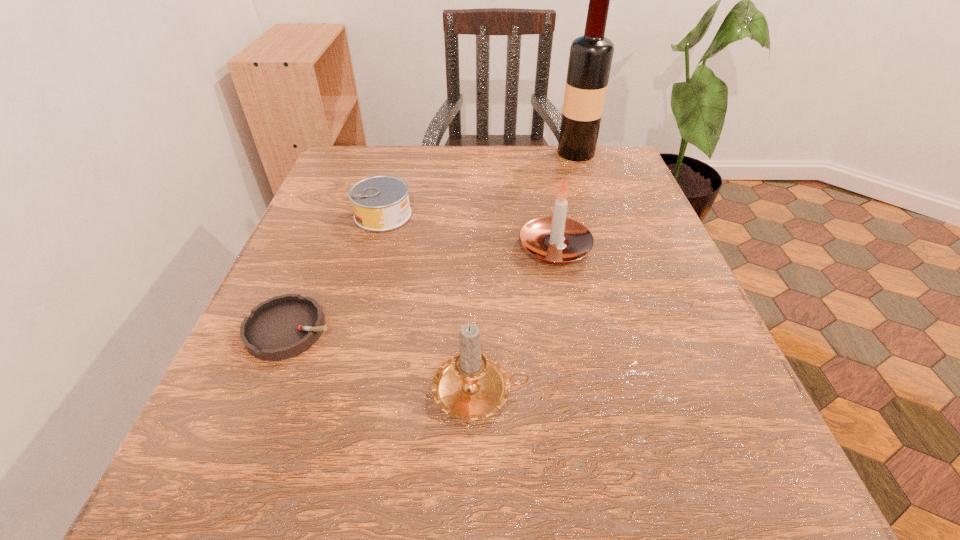
You are a GUI agent. You are given a task and a screenshot of the screen. Output one action in this format:
    pyautogui.click(x=<x>, y=<y>)
    Task: Click on the blank space at the left edge of the desktop
    This screenshot has width=960, height=540.
    Given the screenshot: What is the action you would take?
    pyautogui.click(x=335, y=254)

Where is `free space at the right edge of the desktop`? The width and height of the screenshot is (960, 540). free space at the right edge of the desktop is located at coordinates (644, 206).

Locate an element on the screen. vacant space at the far left corner of the desktop is located at coordinates (386, 174).

This screenshot has width=960, height=540. I want to click on blank space at the far right corner of the desktop, so click(x=576, y=162).

Image resolution: width=960 pixels, height=540 pixels. Identify the location of vacant area that lies between the fourth tallest object and the farthest object. (480, 184).

Locate an element on the screen. The height and width of the screenshot is (540, 960). unoccupied position between the fourth tallest object and the right candle is located at coordinates (468, 232).

Locate an element on the screen. The height and width of the screenshot is (540, 960). free space between the farther candle and the nearer candle is located at coordinates (517, 320).

Where is `free spot between the third object from right to left and the shortest object`? The image size is (960, 540). free spot between the third object from right to left and the shortest object is located at coordinates (385, 361).

Find the location of a particular element. unoccupied area between the left candle and the fourth tallest object is located at coordinates (432, 303).

At what (x,y) coordinates should I click in order to perform the action: click on free space between the ashtray and the second shortest object. Please return your answer as a coordinate pair (x, y). Image resolution: width=960 pixels, height=540 pixels. Looking at the image, I should click on (337, 273).